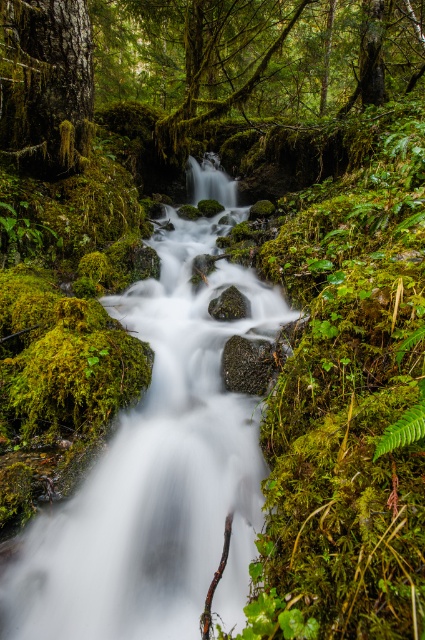
You are a hiker trying to navigate through the forest. You see the green mossy tree trunk at upper left and the green mossy rock at center. Which object is taller?

The green mossy tree trunk at upper left is taller than the green mossy rock at center.

You are a hiker trying to cross the rough textured rock at center. To your left, there is a white smooth stream at center. Which direction should you move to avoid the stream?

You should move to the right to avoid the white smooth stream at center, as it is located to the left of the rough textured rock at center.